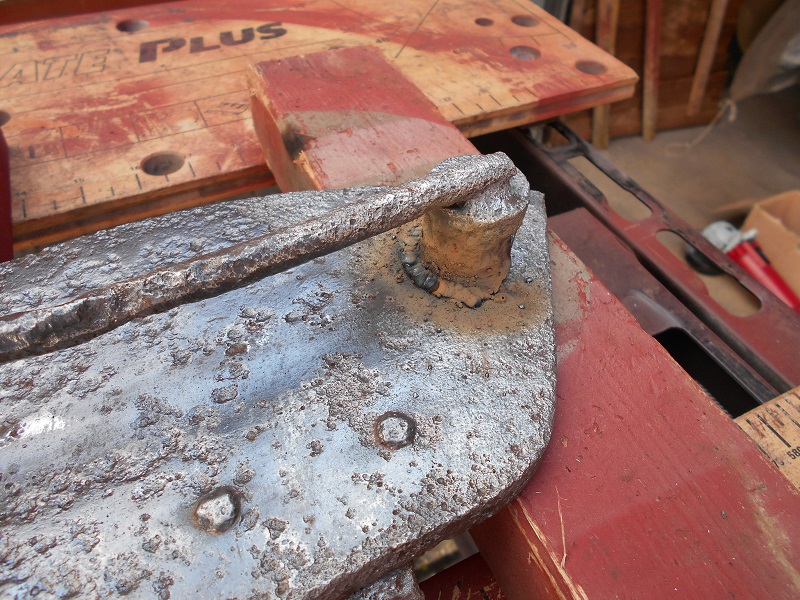
Image resolution: width=800 pixels, height=600 pixels. I want to click on bar, so click(x=262, y=267).